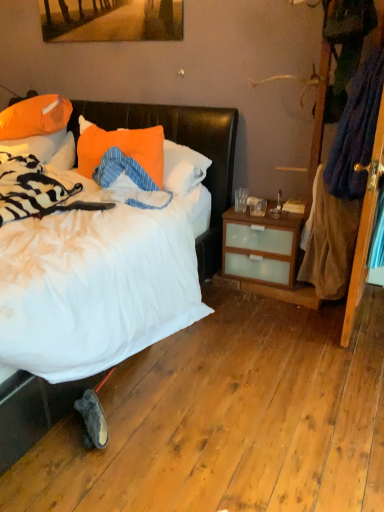
Question: From a real-world perspective, is orange fabric pillow at upper left, the 3th pillow in the right-to-left sequence, positioned over wooden screen door at right based on gravity?

Choices:
 (A) no
 (B) yes

Answer: (A)

Question: Can you confirm if orange fabric pillow at upper left, the 3th pillow in the right-to-left sequence, is wider than wooden screen door at right?

Choices:
 (A) no
 (B) yes

Answer: (A)

Question: From a real-world perspective, is orange fabric pillow at upper left, the first pillow positioned from the left, below wooden screen door at right?

Choices:
 (A) no
 (B) yes

Answer: (B)

Question: Does orange fabric pillow at upper left, the 3th pillow in the right-to-left sequence, have a lesser width compared to wooden screen door at right?

Choices:
 (A) no
 (B) yes

Answer: (B)

Question: Is orange fabric pillow at upper left, the first pillow positioned from the left, taller than wooden screen door at right?

Choices:
 (A) yes
 (B) no

Answer: (B)

Question: Would you say orange fabric pillow at upper left, the 3th pillow in the right-to-left sequence, is outside wooden screen door at right?

Choices:
 (A) yes
 (B) no

Answer: (A)

Question: Is orange fabric pillow at upper left, which is the 2th pillow from right to left, oriented towards orange fabric pillow at center, the 1th pillow from the right?

Choices:
 (A) yes
 (B) no

Answer: (B)

Question: Does orange fabric pillow at upper left, which is the 2th pillow from right to left, have a larger size compared to orange fabric pillow at center, the 1th pillow from the right?

Choices:
 (A) no
 (B) yes

Answer: (B)

Question: From the image's perspective, is orange fabric pillow at upper left, which is counted as the second pillow, starting from the left, over orange fabric pillow at center, the 1th pillow from the right?

Choices:
 (A) yes
 (B) no

Answer: (A)

Question: Is orange fabric pillow at upper left, which is the 2th pillow from right to left, outside orange fabric pillow at center, marked as the third pillow in a left-to-right arrangement?

Choices:
 (A) yes
 (B) no

Answer: (A)

Question: Is orange fabric pillow at upper left, which is counted as the second pillow, starting from the left, smaller than orange fabric pillow at center, the 1th pillow from the right?

Choices:
 (A) yes
 (B) no

Answer: (B)

Question: Does orange fabric pillow at upper left, which is the 2th pillow from right to left, have a greater width compared to orange fabric pillow at center, marked as the third pillow in a left-to-right arrangement?

Choices:
 (A) no
 (B) yes

Answer: (B)

Question: Does orange fabric pillow at center, the 1th pillow from the right, have a larger size compared to wooden screen door at right?

Choices:
 (A) no
 (B) yes

Answer: (B)